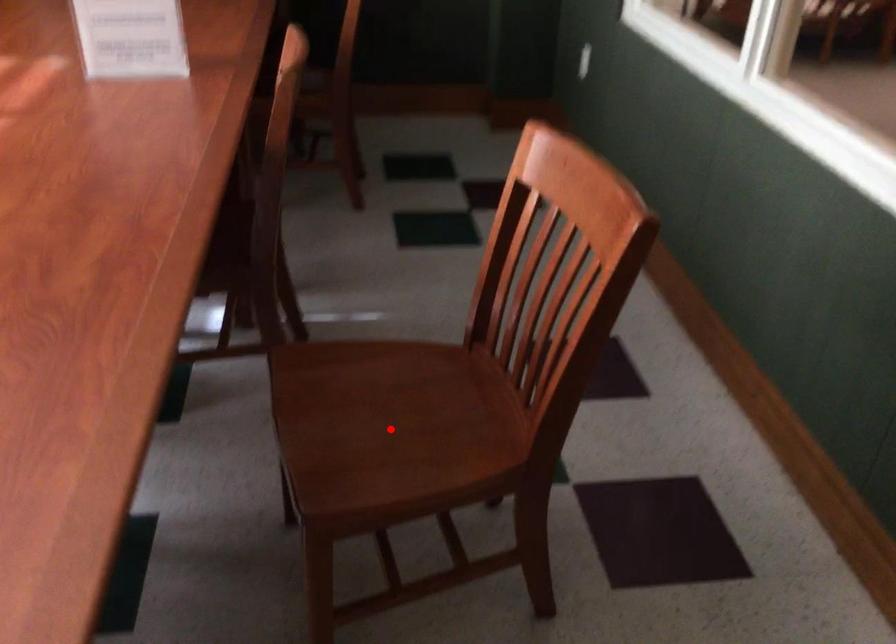
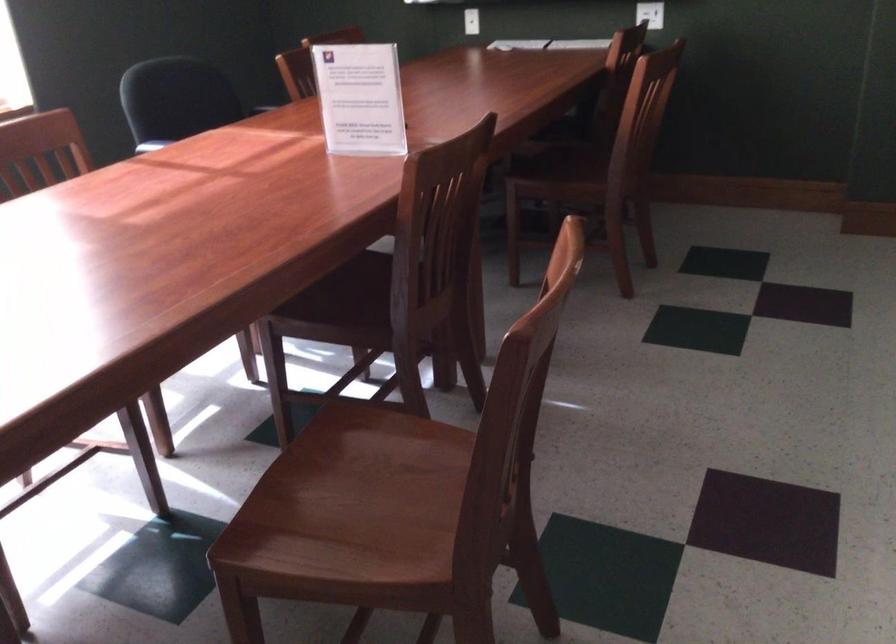
Find the pixel in the second image that matches the highlighted location in the first image.

(351, 504)